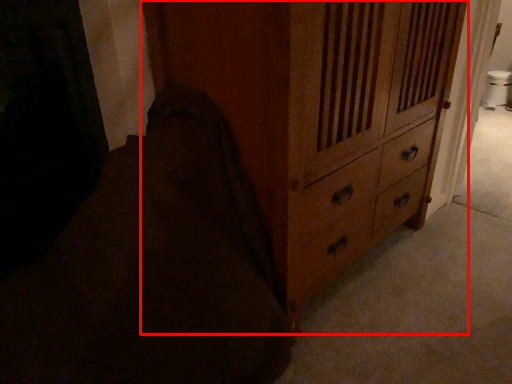
Question: From the image's perspective, what is the correct spatial positioning of chest of drawers (annotated by the red box) in reference to bedding?

Choices:
 (A) below
 (B) above

Answer: (B)